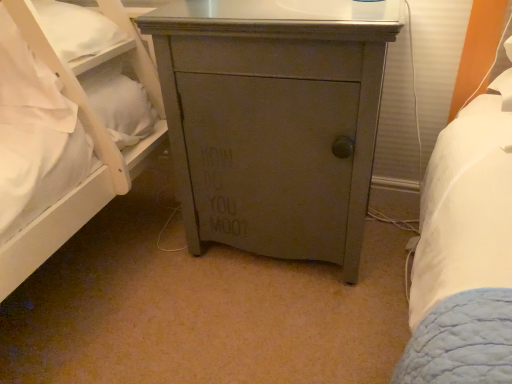
Question: From a real-world perspective, is white soft pillow at left positioned above or below matte gray cabinet at center?

Choices:
 (A) above
 (B) below

Answer: (A)

Question: Would you say white soft pillow at left is to the left or to the right of matte gray cabinet at center in the picture?

Choices:
 (A) left
 (B) right

Answer: (A)

Question: Looking at the image, does white soft pillow at left seem bigger or smaller compared to matte gray cabinet at center?

Choices:
 (A) big
 (B) small

Answer: (B)

Question: Is matte gray cabinet at center inside the boundaries of white soft pillow at left, or outside?

Choices:
 (A) inside
 (B) outside

Answer: (B)

Question: In the image, is matte gray cabinet at center positioned in front of or behind white soft pillow at left?

Choices:
 (A) behind
 (B) front

Answer: (B)

Question: In terms of height, does matte gray cabinet at center look taller or shorter compared to white soft pillow at left?

Choices:
 (A) tall
 (B) short

Answer: (A)

Question: Is point (243, 74) positioned closer to the camera than point (71, 122)?

Choices:
 (A) closer
 (B) farther

Answer: (A)